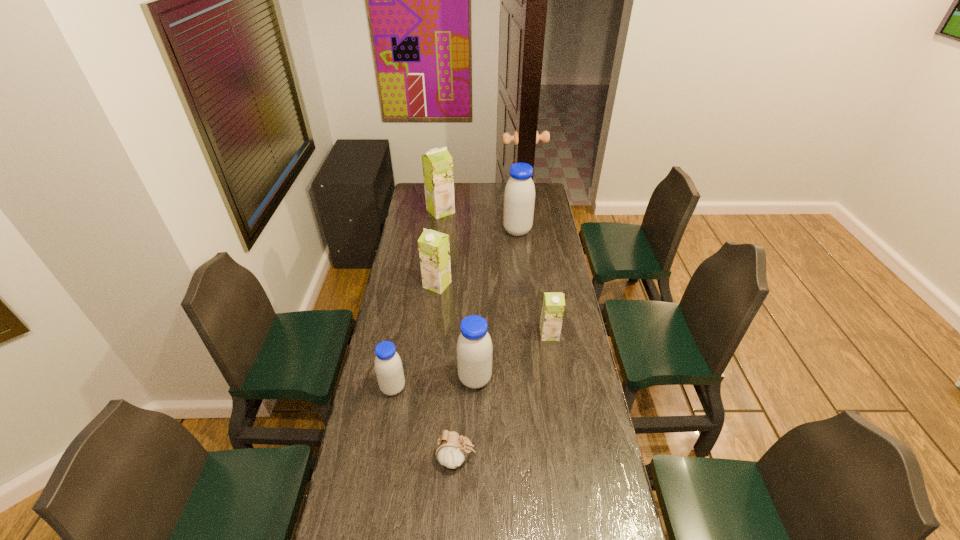
Where is `object located in the far edge section of the desktop`? object located in the far edge section of the desktop is located at coordinates (437, 163).

What are the coordinates of `object situated at the far left corner` in the screenshot? It's located at (437, 163).

In the image, there is a desktop. At what (x,y) coordinates should I click in order to perform the action: click on free region at the far edge. Please return your answer as a coordinate pair (x, y). Image resolution: width=960 pixels, height=540 pixels. Looking at the image, I should click on (482, 198).

Where is `vacant space at the left edge of the desktop`? vacant space at the left edge of the desktop is located at coordinates (342, 518).

The image size is (960, 540). Identify the location of free location at the right edge. (579, 402).

Find the location of a particular element. Image resolution: width=960 pixels, height=540 pixels. free area in between the smallest blue soya milk and the shortest object is located at coordinates (425, 423).

What are the coordinates of `free space between the rightmost blue soya milk and the second blue soya milk from right to left` in the screenshot? It's located at (496, 305).

At what (x,y) coordinates should I click in order to perform the action: click on free space that is in between the smallest green soya milk and the white pouch. Please return your answer as a coordinate pair (x, y). Image resolution: width=960 pixels, height=540 pixels. Looking at the image, I should click on (503, 396).

You are a GUI agent. You are given a task and a screenshot of the screen. Output one action in this format:
    pyautogui.click(x=<x>, y=<y>)
    Task: Click on the free space between the fourth soya milk from left to right and the second nearest green soya milk
    This screenshot has height=540, width=960.
    Given the screenshot: What is the action you would take?
    pyautogui.click(x=456, y=332)

Image resolution: width=960 pixels, height=540 pixels. Find the location of `vacant point located between the fourth farthest object and the farthest object`. vacant point located between the fourth farthest object and the farthest object is located at coordinates (495, 273).